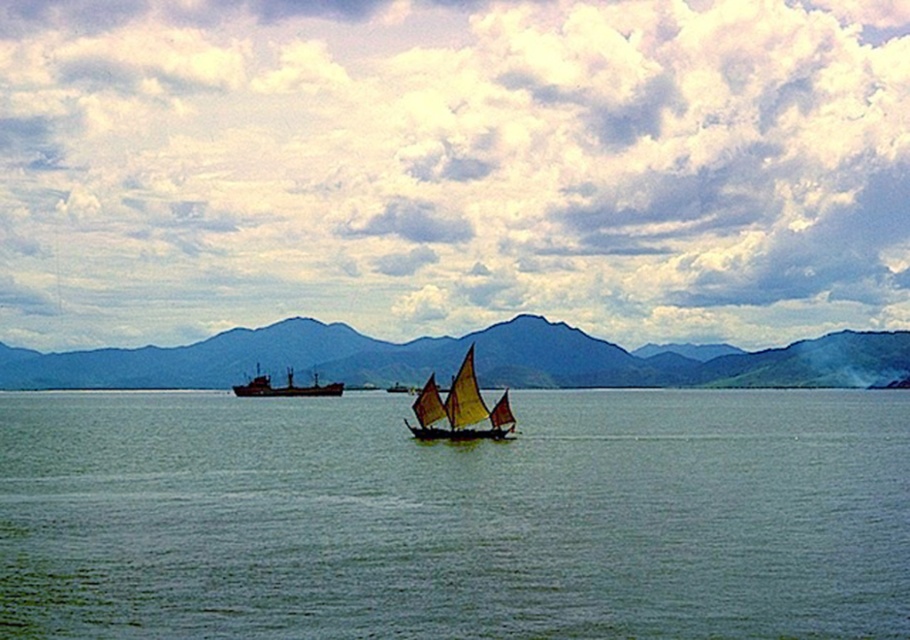
Question: Which of the following is the farthest from the observer?

Choices:
 (A) green smooth water at center
 (B) dark blue mountain at center

Answer: (B)

Question: Among these objects, which one is nearest to the camera?

Choices:
 (A) dark blue mountain at center
 (B) green smooth water at center
 (C) yellow fabric sailboat at center
 (D) dark gray matte cargo ship at center

Answer: (B)

Question: Where is green smooth water at center located in relation to dark blue mountain at center in the image?

Choices:
 (A) right
 (B) left

Answer: (A)

Question: Based on their relative distances, which object is nearer to the dark blue mountain at center?

Choices:
 (A) yellow fabric sailboat at center
 (B) dark gray matte cargo ship at center
 (C) green smooth water at center

Answer: (B)

Question: Does green smooth water at center appear on the right side of yellow fabric sailboat at center?

Choices:
 (A) yes
 (B) no

Answer: (B)

Question: Is green smooth water at center positioned before dark gray matte cargo ship at center?

Choices:
 (A) no
 (B) yes

Answer: (B)